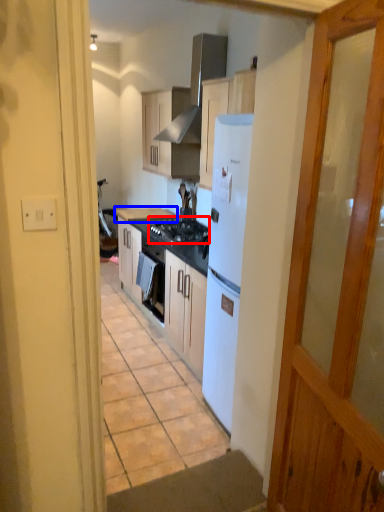
Question: Which point is further to the camera, gas stove (highlighted by a red box) or countertop (highlighted by a blue box)?

Choices:
 (A) gas stove
 (B) countertop

Answer: (B)